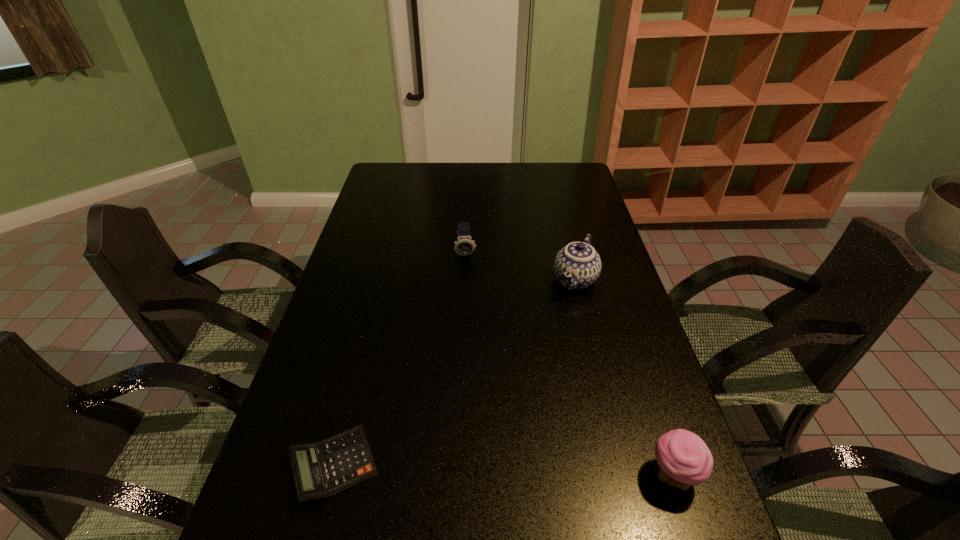
Locate an element on the screen. This screenshot has height=540, width=960. free point located from the spout of the tallest object is located at coordinates (562, 311).

This screenshot has width=960, height=540. In order to click on vacant space located from the spout of the tallest object in this screenshot , I will do `click(511, 400)`.

At what (x,y) coordinates should I click in order to perform the action: click on free space located 0.250m from the spout of the tallest object. Please return your answer as a coordinate pair (x, y). The image size is (960, 540). Looking at the image, I should click on (534, 359).

Find the location of a particular element. calculator at the near edge is located at coordinates (320, 470).

At what (x,y) coordinates should I click in order to perform the action: click on cupcake at the near edge. Please return your answer as a coordinate pair (x, y). Looking at the image, I should click on (684, 460).

Locate an element on the screen. The width and height of the screenshot is (960, 540). object that is at the left edge is located at coordinates (320, 470).

At what (x,y) coordinates should I click in order to perform the action: click on cupcake at the right edge. Please return your answer as a coordinate pair (x, y). Looking at the image, I should click on (684, 460).

Where is `chinaware present at the right edge`? This screenshot has height=540, width=960. chinaware present at the right edge is located at coordinates (577, 266).

What are the coordinates of `object located at the near left corner` in the screenshot? It's located at (320, 470).

The height and width of the screenshot is (540, 960). In order to click on object situated at the near right corner in this screenshot , I will do `click(684, 460)`.